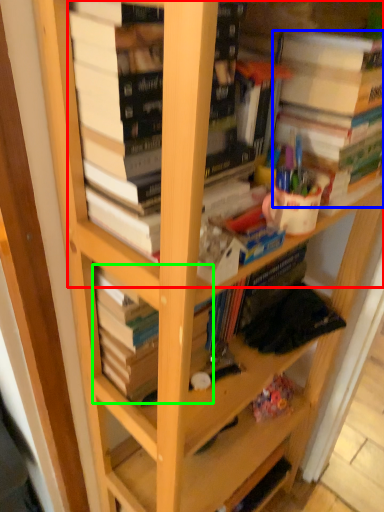
Question: Which object is positioned farthest from book (highlighted by a red box)? Select from book (highlighted by a blue box) and book (highlighted by a green box).

Choices:
 (A) book
 (B) book

Answer: (B)